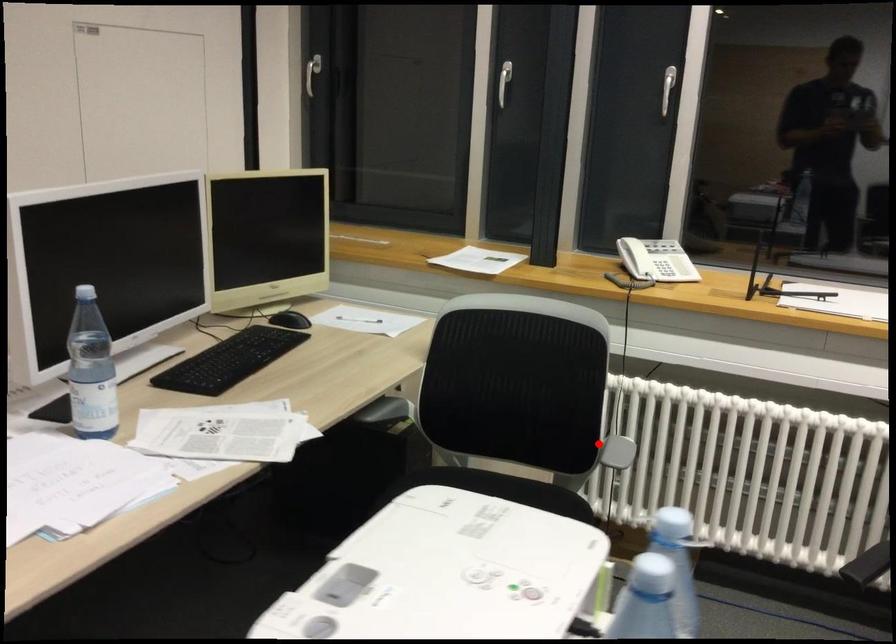
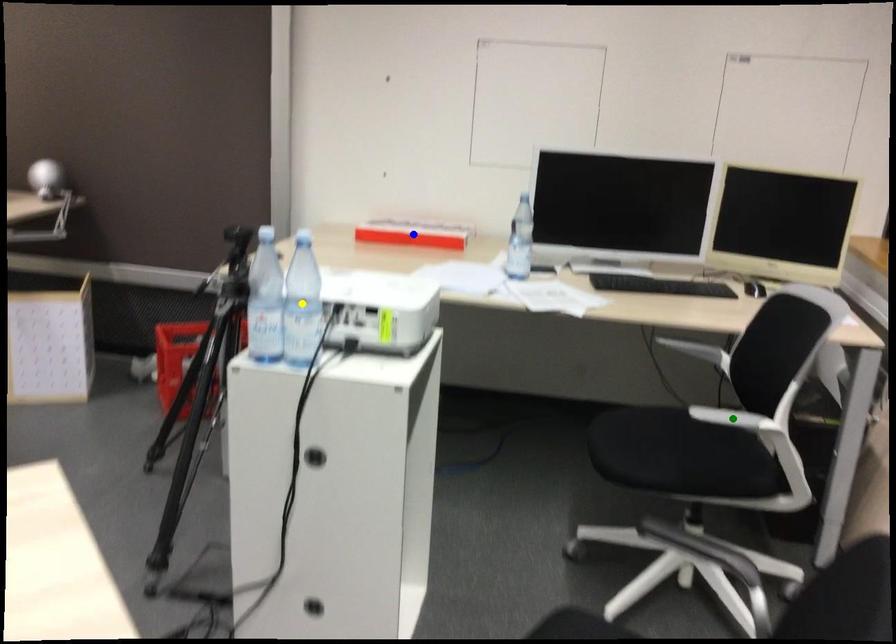
Question: I am providing you with two images of the same scene from different viewpoints. A red point is marked on the first image. You are given multiple points on the second image. Which point in image 2 represents the same 3d spot as the red point in image 1?

Choices:
 (A) blue point
 (B) green point
 (C) yellow point

Answer: (B)